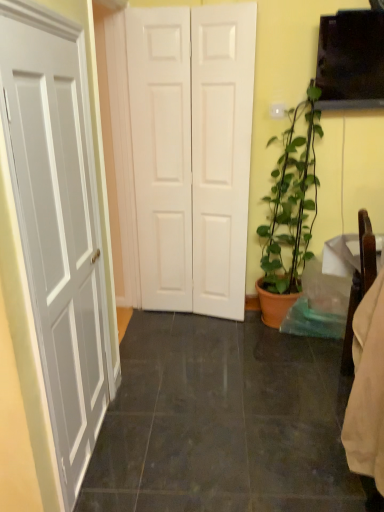
Identify the location of free point above white matte door at center (from a real-world perspective). Image resolution: width=384 pixels, height=512 pixels. (176, 1).